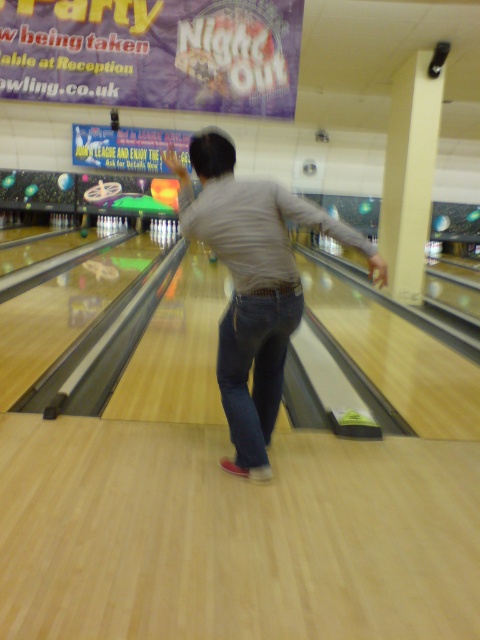
Who is more distant from viewer, [311,212] or [259,376]?

The point [259,376] is more distant.

Can you confirm if denim jeans at center is wider than dark blue denim jeans at center?

Yes.

Does point (252, 394) lie behind point (228, 410)?

Yes, point (252, 394) is behind point (228, 410).

Identify the location of denim jeans at center. (252, 284).